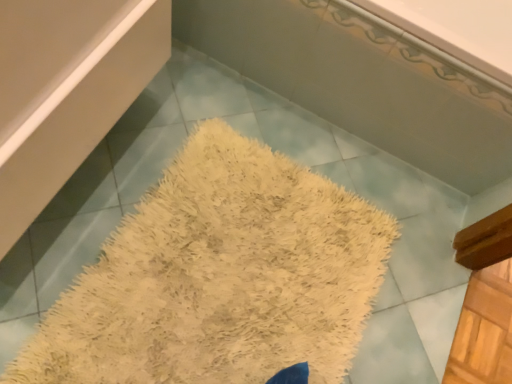
Measure the distance between white fluffy bath mat at center and camera.

The distance of white fluffy bath mat at center from camera is 1.04 meters.

The height and width of the screenshot is (384, 512). Describe the element at coordinates (220, 277) in the screenshot. I see `white fluffy bath mat at center` at that location.

This screenshot has height=384, width=512. What are the coordinates of `white fluffy bath mat at center` in the screenshot? It's located at (220, 277).

From the picture: In order to face white fluffy bath mat at center, should I rotate leftwards or rightwards?

A 1.000 degree turn to the right will do.

What do you see at coordinates (361, 82) in the screenshot? This screenshot has height=384, width=512. I see `white shaggy rug at center` at bounding box center [361, 82].

You are a GUI agent. You are given a task and a screenshot of the screen. Output one action in this format:
    pyautogui.click(x=<x>, y=<y>)
    Task: Click on the white shaggy rug at center
    Image resolution: width=512 pixels, height=384 pixels.
    Given the screenshot: What is the action you would take?
    pyautogui.click(x=361, y=82)

Find the location of a particular element. Image resolution: width=512 pixels, height=384 pixels. white fluffy bath mat at center is located at coordinates (220, 277).

Which is more to the left, white shaggy rug at center or white fluffy bath mat at center?

From the viewer's perspective, white fluffy bath mat at center appears more on the left side.

Is white shaggy rug at center positioned behind white fluffy bath mat at center?

That is True.

From the picture: Which is closer, (330,93) or (251,199)?

The point (251,199) is in front.

From the image's perspective, does white shaggy rug at center appear higher than white fluffy bath mat at center?

Yes, from the image's perspective, white shaggy rug at center is over white fluffy bath mat at center.

From a real-world perspective, is white shaggy rug at center physically below white fluffy bath mat at center?

Incorrect, from a real-world perspective, white shaggy rug at center is higher than white fluffy bath mat at center.

Considering the sizes of white shaggy rug at center and white fluffy bath mat at center in the image, is white shaggy rug at center wider or thinner than white fluffy bath mat at center?

In the image, white shaggy rug at center appears to be more narrow than white fluffy bath mat at center.

Is white shaggy rug at center shorter than white fluffy bath mat at center?

No, white shaggy rug at center is not shorter than white fluffy bath mat at center.

Can you confirm if white shaggy rug at center is smaller than white fluffy bath mat at center?

No.

Would you say white shaggy rug at center is inside or outside white fluffy bath mat at center?

white shaggy rug at center lies outside white fluffy bath mat at center.

Can you see white shaggy rug at center touching white fluffy bath mat at center?

white shaggy rug at center and white fluffy bath mat at center are not in contact.

Could you tell me if white shaggy rug at center is facing white fluffy bath mat at center?

Yes, white shaggy rug at center is oriented towards white fluffy bath mat at center.

The width and height of the screenshot is (512, 384). In order to click on bath above the white fluffy bath mat at center (from the image's perspective) in this screenshot , I will do `click(361, 82)`.

Visually, is white fluffy bath mat at center positioned to the left or to the right of white shaggy rug at center?

In the image, white fluffy bath mat at center appears on the left side of white shaggy rug at center.

Considering the relative positions of white fluffy bath mat at center and white shaggy rug at center in the image provided, is white fluffy bath mat at center behind white shaggy rug at center?

No, white fluffy bath mat at center is closer to the viewer.

Considering the positions of point (334, 294) and point (465, 82), is point (334, 294) closer or farther from the camera than point (465, 82)?

Clearly, point (334, 294) is more distant from the camera than point (465, 82).

From the image's perspective, does white fluffy bath mat at center appear lower than white shaggy rug at center?

A: Yes, from the image's perspective, white fluffy bath mat at center is beneath white shaggy rug at center.

From a real-world perspective, is white fluffy bath mat at center positioned under white shaggy rug at center based on gravity?

Answer: Indeed, from a real-world perspective, white fluffy bath mat at center is positioned beneath white shaggy rug at center.

Does white fluffy bath mat at center have a greater width compared to white shaggy rug at center?

Yes, white fluffy bath mat at center is wider than white shaggy rug at center.

Considering the sizes of objects white fluffy bath mat at center and white shaggy rug at center in the image provided, who is taller, white fluffy bath mat at center or white shaggy rug at center?

white shaggy rug at center is taller.

Does white fluffy bath mat at center have a smaller size compared to white shaggy rug at center?

Correct, white fluffy bath mat at center occupies less space than white shaggy rug at center.

Which is correct: white fluffy bath mat at center is inside white shaggy rug at center, or outside of it?

white fluffy bath mat at center is spatially situated outside white shaggy rug at center.

From the picture: Are white fluffy bath mat at center and white shaggy rug at center located far from each other?

That's not correct — white fluffy bath mat at center is a little close to white shaggy rug at center.

Could you tell me if white fluffy bath mat at center is turned towards white shaggy rug at center?

No, white fluffy bath mat at center is not facing towards white shaggy rug at center.

How different are the orientations of white fluffy bath mat at center and white shaggy rug at center in degrees?

The facing directions of white fluffy bath mat at center and white shaggy rug at center are 90.8 degrees apart.

Find the location of a particular element. The height and width of the screenshot is (384, 512). bath that is behind the white fluffy bath mat at center is located at coordinates (361, 82).

This screenshot has height=384, width=512. I want to click on bath mat below the white shaggy rug at center (from a real-world perspective), so click(220, 277).

Image resolution: width=512 pixels, height=384 pixels. I want to click on bath mat below the white shaggy rug at center (from the image's perspective), so click(220, 277).